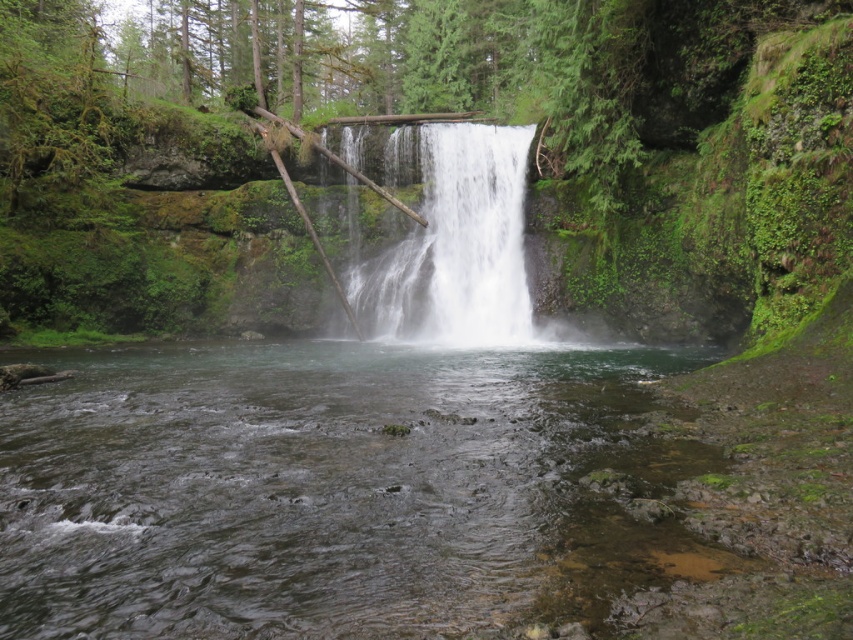
Question: Is clear water at center bigger than white frothy water at center?

Choices:
 (A) yes
 (B) no

Answer: (B)

Question: Which point is closer to the camera?

Choices:
 (A) (10, 403)
 (B) (440, 157)

Answer: (A)

Question: Can you confirm if clear water at center is wider than white frothy water at center?

Choices:
 (A) yes
 (B) no

Answer: (A)

Question: Is the position of clear water at center less distant than that of white frothy water at center?

Choices:
 (A) yes
 (B) no

Answer: (A)

Question: Among these points, which one is farthest from the camera?

Choices:
 (A) (532, 490)
 (B) (506, 177)

Answer: (B)